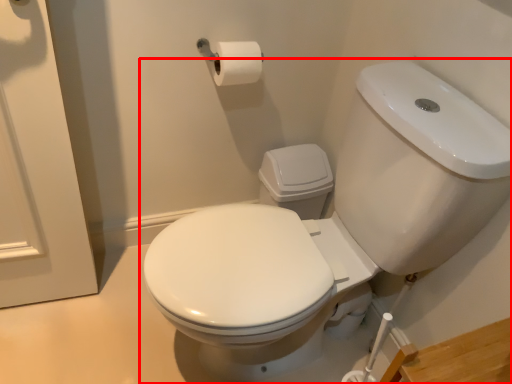
Question: Observing the image, what is the correct spatial positioning of toilet (annotated by the red box) in reference to toilet paper?

Choices:
 (A) left
 (B) right

Answer: (B)